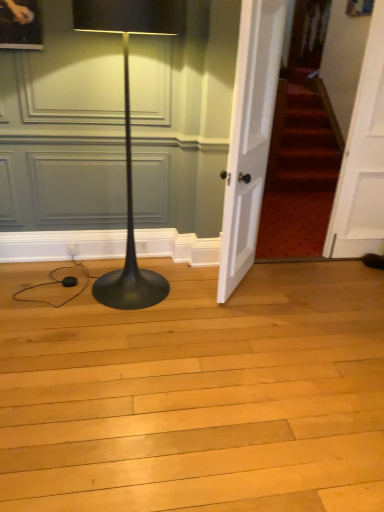
This screenshot has width=384, height=512. Identify the location of vacant area that is in front of white wooden door at right, the 1th door in the right-to-left sequence. (350, 283).